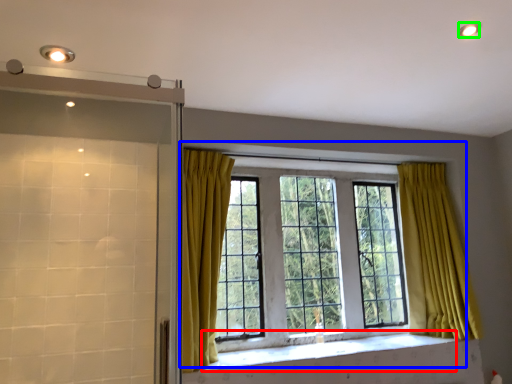
Question: Which is nearer to the window sill (highlighted by a red box)? window (highlighted by a blue box) or lighting (highlighted by a green box).

Choices:
 (A) window
 (B) lighting

Answer: (A)